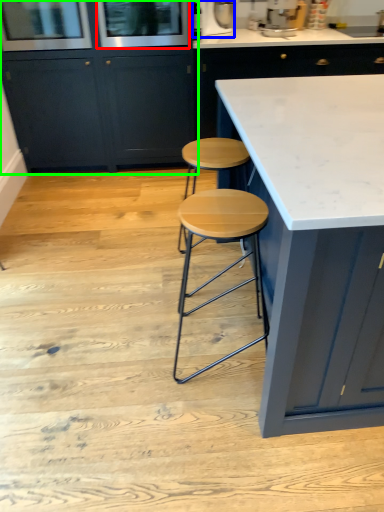
Question: Which is nearer to the screen door (highlighted by a red box)? appliance (highlighted by a blue box) or cabinetry (highlighted by a green box).

Choices:
 (A) appliance
 (B) cabinetry

Answer: (B)